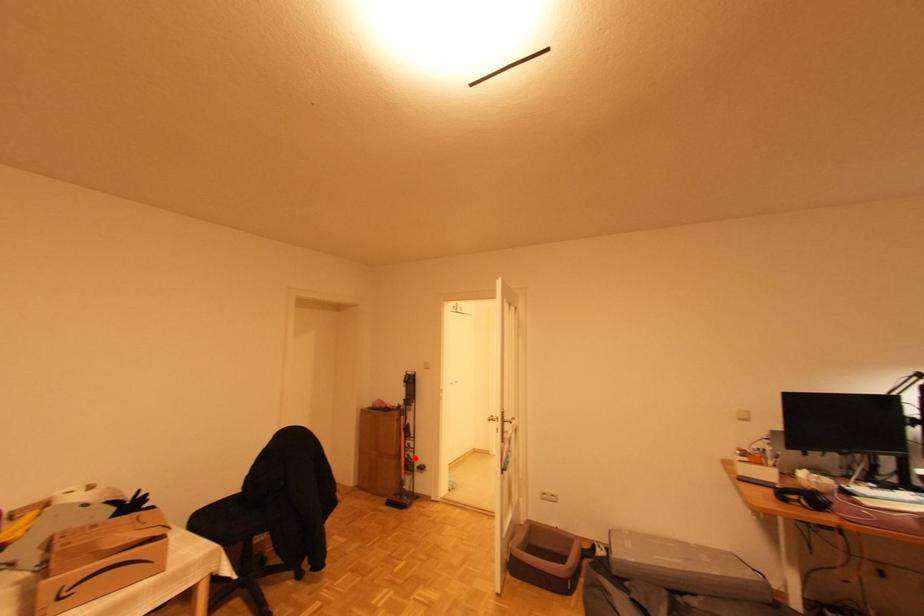
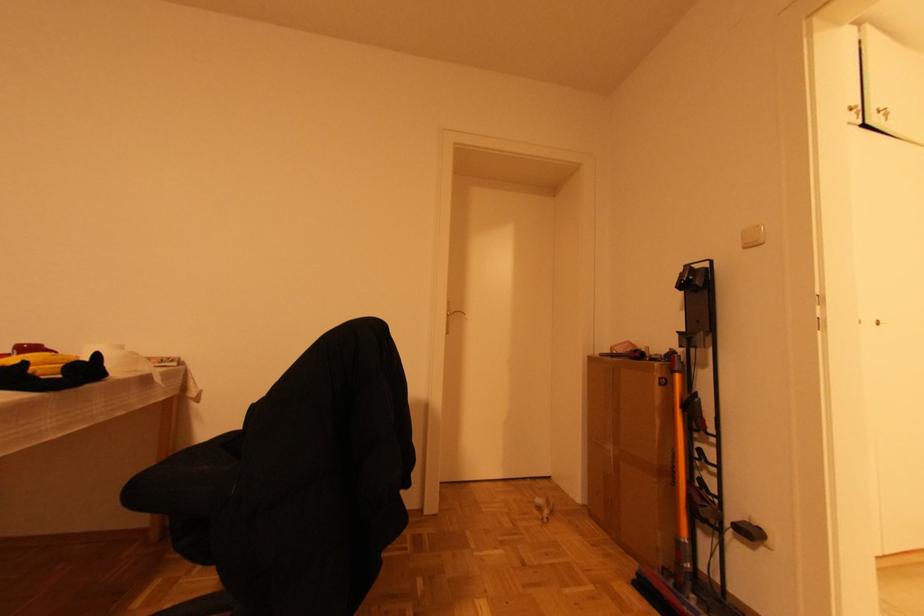
The point at the highlighted location is marked in the first image. Where is the corresponding point in the second image?

(716, 492)